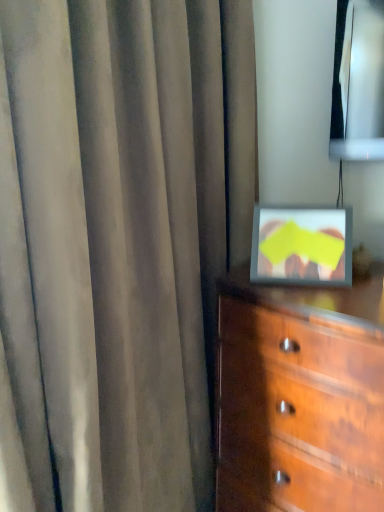
Question: Considering the relative sizes of wooden chest of drawers at lower right and satin gray curtain at center in the image provided, is wooden chest of drawers at lower right shorter than satin gray curtain at center?

Choices:
 (A) yes
 (B) no

Answer: (A)

Question: Does wooden chest of drawers at lower right contain satin gray curtain at center?

Choices:
 (A) no
 (B) yes

Answer: (A)

Question: From the image's perspective, would you say wooden chest of drawers at lower right is shown under satin gray curtain at center?

Choices:
 (A) yes
 (B) no

Answer: (A)

Question: From a real-world perspective, is wooden chest of drawers at lower right below satin gray curtain at center?

Choices:
 (A) yes
 (B) no

Answer: (A)

Question: Is wooden chest of drawers at lower right aimed at satin gray curtain at center?

Choices:
 (A) no
 (B) yes

Answer: (A)

Question: Is wooden chest of drawers at lower right oriented away from satin gray curtain at center?

Choices:
 (A) no
 (B) yes

Answer: (A)

Question: Can you confirm if satin gray curtain at center is thinner than wooden chest of drawers at lower right?

Choices:
 (A) yes
 (B) no

Answer: (A)

Question: Is satin gray curtain at center closer to camera compared to wooden chest of drawers at lower right?

Choices:
 (A) no
 (B) yes

Answer: (B)

Question: Can you confirm if satin gray curtain at center is bigger than wooden chest of drawers at lower right?

Choices:
 (A) no
 (B) yes

Answer: (B)

Question: From the image's perspective, would you say satin gray curtain at center is positioned over wooden chest of drawers at lower right?

Choices:
 (A) yes
 (B) no

Answer: (A)

Question: From the image's perspective, is satin gray curtain at center beneath wooden chest of drawers at lower right?

Choices:
 (A) yes
 (B) no

Answer: (B)

Question: Can wooden chest of drawers at lower right be found inside satin gray curtain at center?

Choices:
 (A) no
 (B) yes

Answer: (A)

Question: From a real-world perspective, is wooden chest of drawers at lower right above or below satin gray curtain at center?

Choices:
 (A) below
 (B) above

Answer: (A)